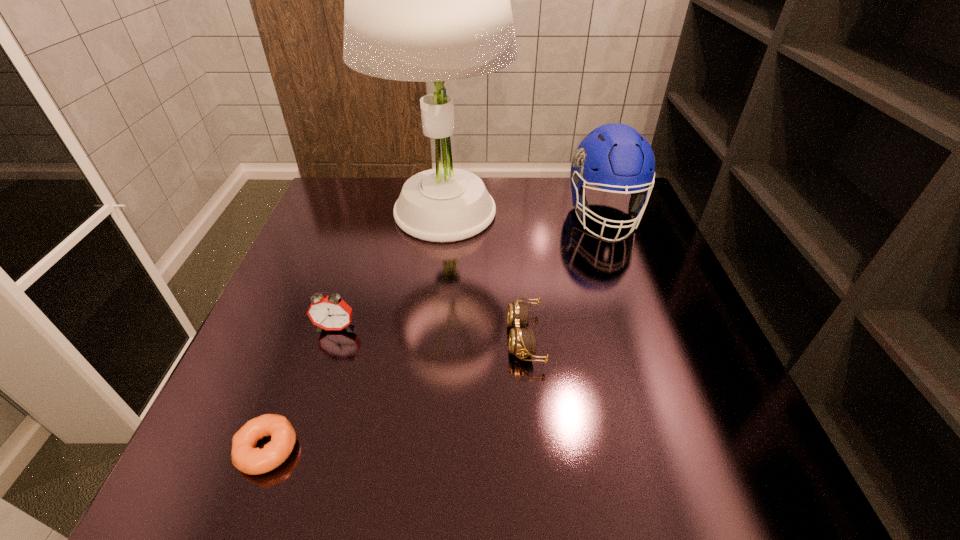
Find the location of a particular element. lamp is located at coordinates (426, 0).

The width and height of the screenshot is (960, 540). Identify the location of football helmet. (615, 157).

The image size is (960, 540). I want to click on the rightmost object, so click(x=615, y=157).

Locate an element on the screen. This screenshot has width=960, height=540. the third tallest object is located at coordinates (330, 312).

Locate an element on the screen. This screenshot has height=540, width=960. the second shortest object is located at coordinates (522, 341).

Identify the location of the shortest object. This screenshot has width=960, height=540. (245, 457).

Locate an element on the screen. This screenshot has height=540, width=960. doughnut is located at coordinates (245, 457).

Locate an element on the screen. The image size is (960, 540). vacant region located 0.180m on the front-facing side of the lamp is located at coordinates (431, 309).

Locate an element on the screen. vacant space located 0.050m on the front-facing side of the rightmost object is located at coordinates pyautogui.click(x=621, y=260).

Locate an element on the screen. This screenshot has height=540, width=960. vacant space located 0.200m on the clock face of the alarm clock is located at coordinates (304, 424).